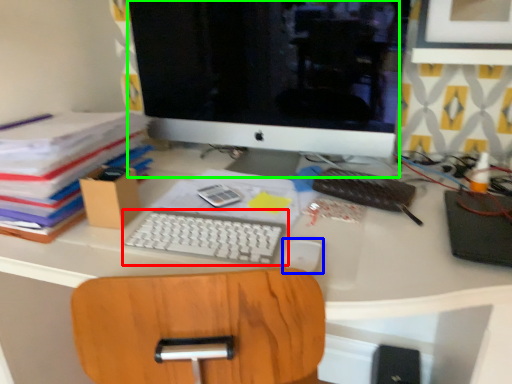
Question: Based on their relative distances, which object is nearer to computer keyboard (highlighted by a red box)? Choose from mouse (highlighted by a blue box) and computer monitor (highlighted by a green box).

Choices:
 (A) mouse
 (B) computer monitor

Answer: (A)